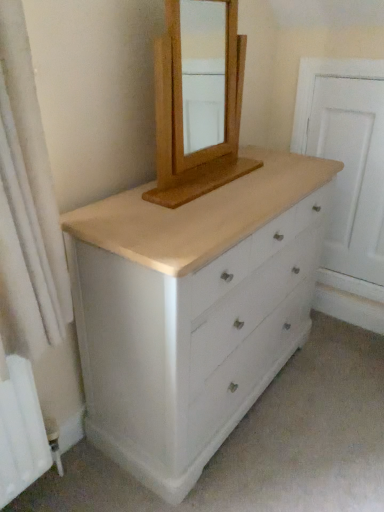
I want to click on vacant space underneath natural wood mirror at upper center (from a real-world perspective), so click(216, 175).